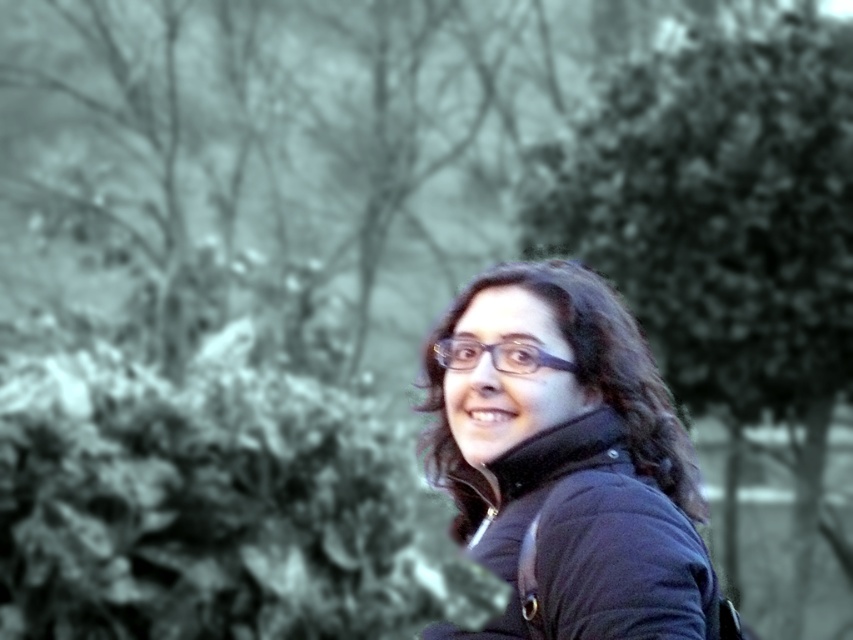
Question: Which point appears closest to the camera in this image?

Choices:
 (A) (677, 264)
 (B) (534, 275)

Answer: (B)

Question: Can you confirm if green leafy tree at right is positioned below matte black jacket at center?

Choices:
 (A) yes
 (B) no

Answer: (B)

Question: Can you confirm if green leafy tree at right is smaller than matte black jacket at center?

Choices:
 (A) yes
 (B) no

Answer: (B)

Question: Can you confirm if green leafy tree at right is positioned to the right of matte black jacket at center?

Choices:
 (A) no
 (B) yes

Answer: (B)

Question: Which point is closer to the camera?

Choices:
 (A) matte black jacket at center
 (B) green leafy tree at right

Answer: (A)